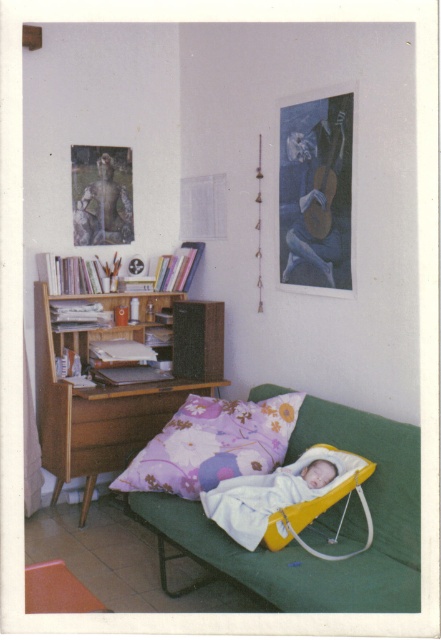
Question: Which object is closer to the camera taking this photo?

Choices:
 (A) yellow plastic infant bed at center
 (B) blue fabric painting at upper right
 (C) purple floral fabric pillow at center

Answer: (A)

Question: Which point is closer to the camera taking this photo?

Choices:
 (A) (235, 525)
 (B) (90, 209)
 (C) (317, 129)

Answer: (A)

Question: Which point is farther from the camera taking this photo?

Choices:
 (A) (257, 502)
 (B) (56, 428)
 (C) (109, 170)

Answer: (C)

Question: Can you confirm if woodenmaterial/texturebookshelf at left is positioned to the right of wooden carved statue at upper left?

Choices:
 (A) no
 (B) yes

Answer: (B)

Question: Is blue fabric painting at upper right wider than wooden carved statue at upper left?

Choices:
 (A) yes
 (B) no

Answer: (B)

Question: In this image, where is green fabric couch at lower center located relative to blue fabric painting at upper right?

Choices:
 (A) left
 (B) right

Answer: (A)